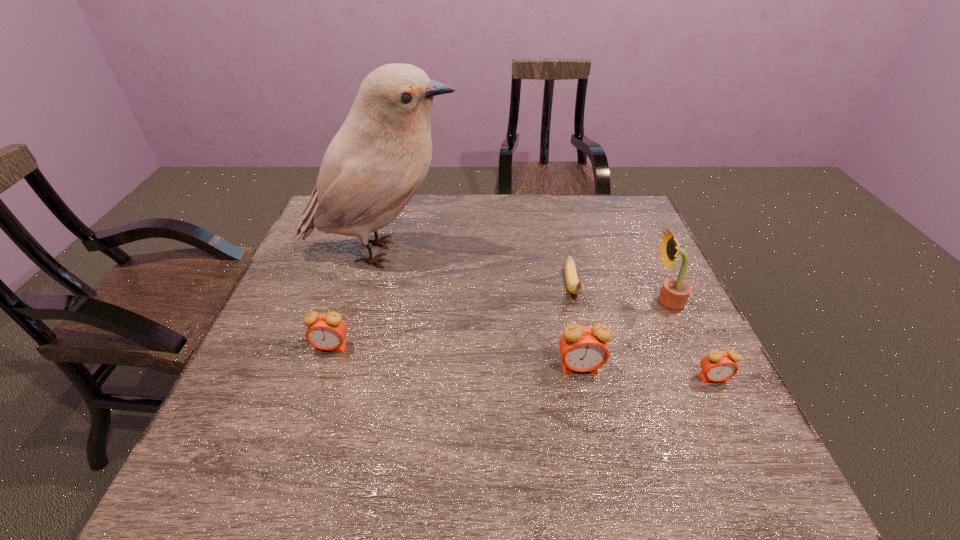
What are the coordinates of `alarm clock that is at the right edge` in the screenshot? It's located at (718, 365).

The width and height of the screenshot is (960, 540). Find the location of `sunflower that is at the right edge`. sunflower that is at the right edge is located at coordinates (675, 291).

I want to click on object present at the far left corner, so click(x=376, y=162).

This screenshot has width=960, height=540. Find the location of `vacant space at the far edge`. vacant space at the far edge is located at coordinates (540, 195).

Find the location of `free space at the near edge`. free space at the near edge is located at coordinates (380, 435).

This screenshot has width=960, height=540. I want to click on vacant space at the left edge of the desktop, so pos(329,245).

The width and height of the screenshot is (960, 540). In order to click on free region at the right edge of the desktop in this screenshot , I will do `click(632, 285)`.

Find the location of a particular element. vacant space at the far right corner is located at coordinates (598, 213).

The image size is (960, 540). Find the location of `free space between the leftmost alarm clock and the tallest object`. free space between the leftmost alarm clock and the tallest object is located at coordinates (356, 300).

Image resolution: width=960 pixels, height=540 pixels. Find the location of `free spot between the sunflower and the fifth tallest object`. free spot between the sunflower and the fifth tallest object is located at coordinates (689, 341).